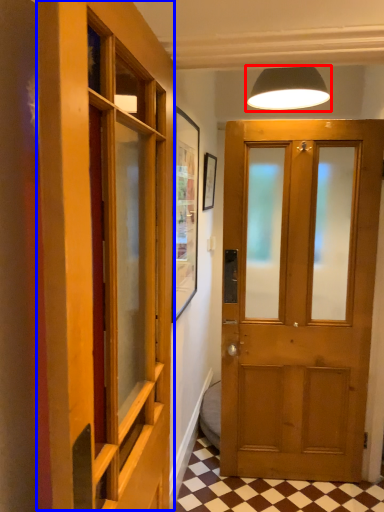
Question: Which object appears farthest to the camera in this image, lamp (highlighted by a red box) or elevator (highlighted by a blue box)?

Choices:
 (A) lamp
 (B) elevator

Answer: (A)